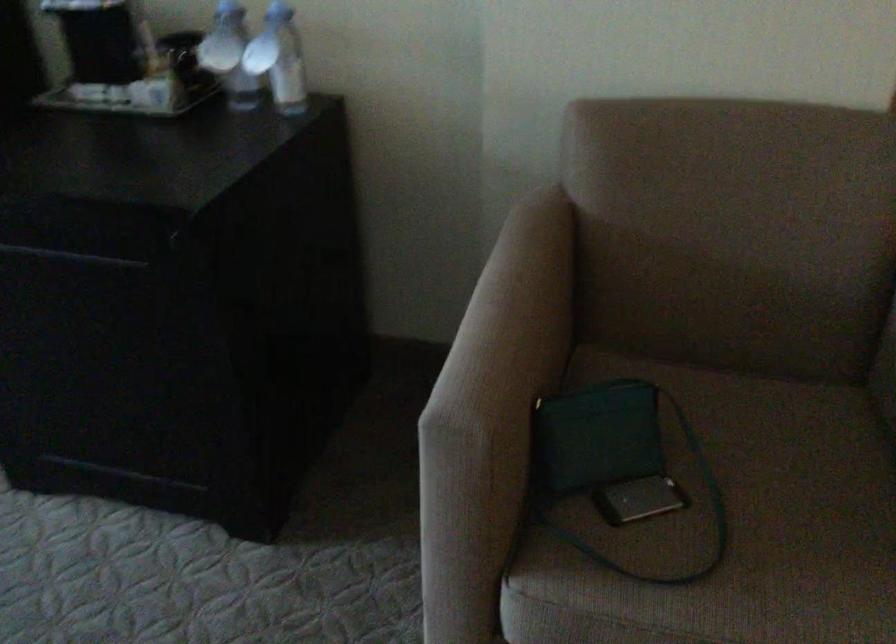
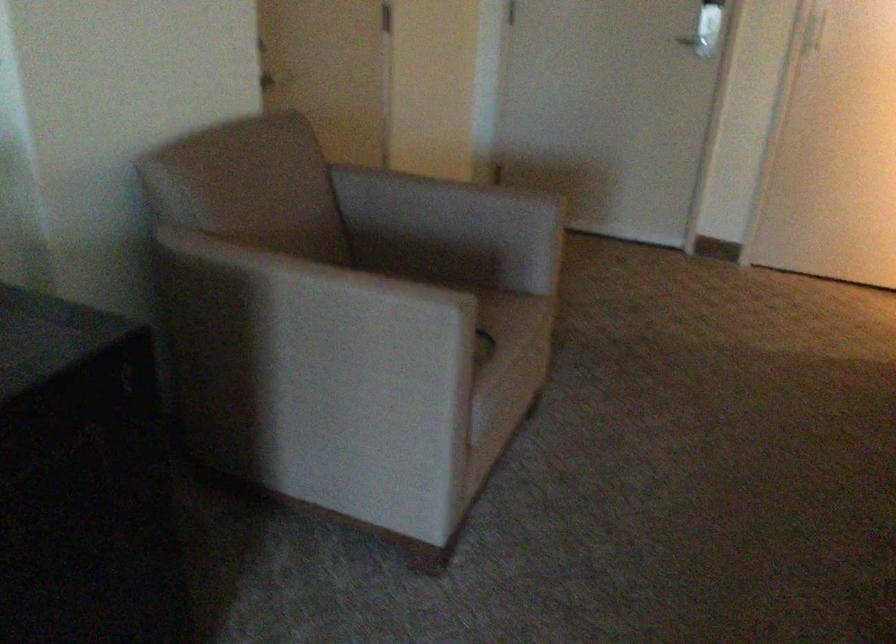
Locate, in the second image, the point that corresponds to point (471, 346) in the first image.

(314, 325)